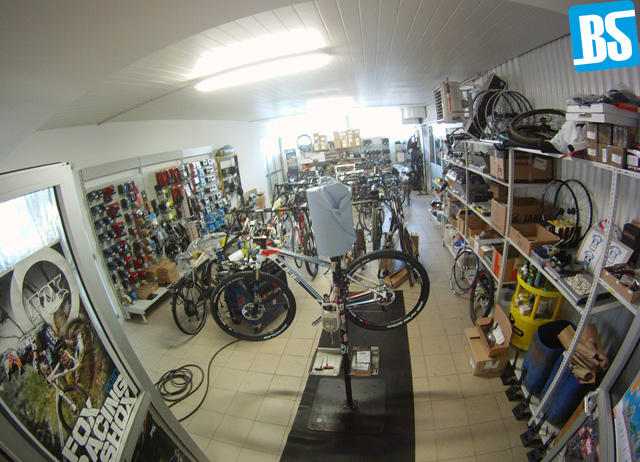
I want to click on ceiling, so click(393, 55).